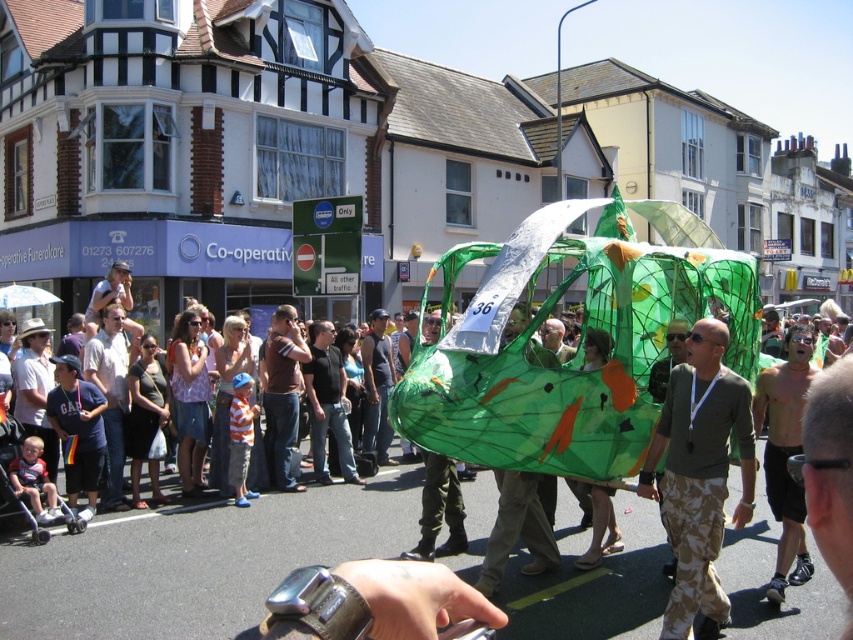
Question: Among these points, which one is farthest from the camera?

Choices:
 (A) (524, 570)
 (B) (450, 493)
 (C) (670, 371)
 (D) (367, 394)

Answer: (D)

Question: Among these points, which one is farthest from the camera?

Choices:
 (A) (788, 330)
 (B) (376, 458)
 (C) (302, 355)

Answer: (A)

Question: Does light brown cotton shirt at center appear over dark brown leather jacket at center?

Choices:
 (A) no
 (B) yes

Answer: (B)

Question: Which point appears closest to the camera in this image?

Choices:
 (A) (793, 371)
 (B) (715, 410)

Answer: (B)

Question: Observing the image, what is the correct spatial positioning of dark brown shirt at center in reference to dark brown leather jacket at center?

Choices:
 (A) below
 (B) above

Answer: (B)

Question: Can you confirm if green fabric kite at center is thinner than dark brown leather jacket at center?

Choices:
 (A) no
 (B) yes

Answer: (A)